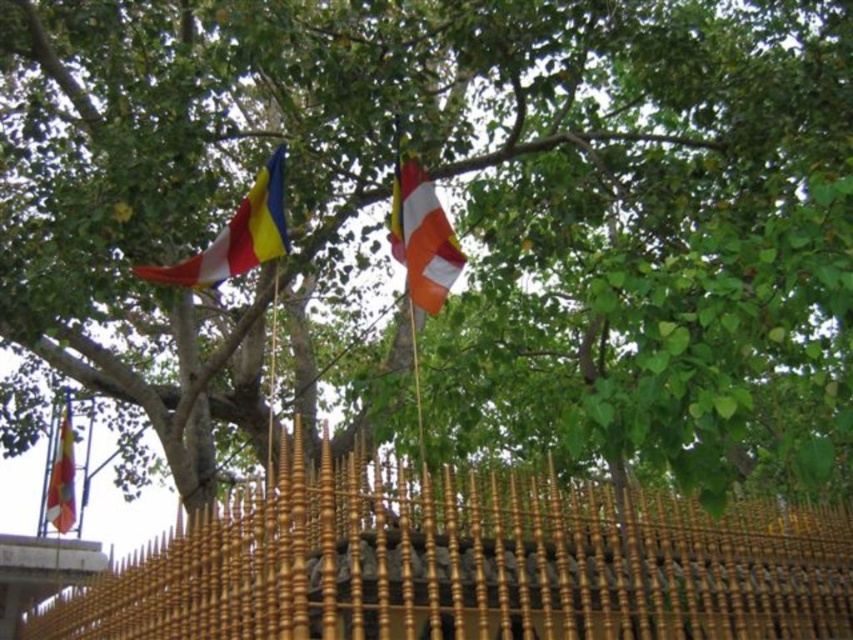
Question: Does matte fabric flag at upper left have a larger size compared to orange and white striped flag at center?

Choices:
 (A) no
 (B) yes

Answer: (B)

Question: Among these objects, which one is nearest to the camera?

Choices:
 (A) orange and white striped flag at center
 (B) matte fabric flag at upper left

Answer: (A)

Question: Can you confirm if gold polished wood fence at lower center is thinner than orange and white striped flag at center?

Choices:
 (A) yes
 (B) no

Answer: (A)

Question: Does gold polished wood fence at lower center have a lesser width compared to matte yellow flag at lower left?

Choices:
 (A) no
 (B) yes

Answer: (B)

Question: Among these points, which one is nearest to the camera?

Choices:
 (A) (280, 154)
 (B) (668, 589)
 (C) (393, 205)
 (D) (68, 465)

Answer: (B)

Question: Which is nearer to the orange and white striped flag at center?

Choices:
 (A) gold polished wood fence at lower center
 (B) matte fabric flag at upper left
 (C) matte yellow flag at lower left

Answer: (B)